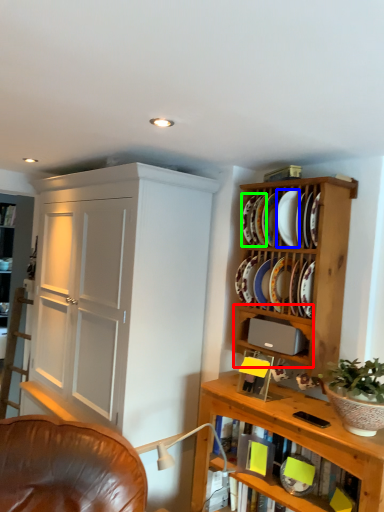
Question: Estimate the real-world distances between objects in this image. Which object is farther from cabinet (highlighted by a red box), plate (highlighted by a blue box) or platter (highlighted by a green box)?

Choices:
 (A) plate
 (B) platter

Answer: (B)